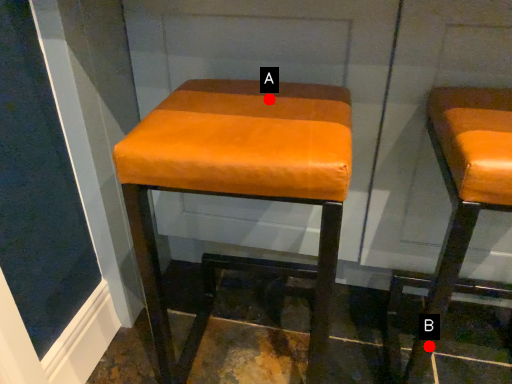
Question: Two points are circled on the image, labeled by A and B beside each circle. Which point is closer to the camera taking this photo?

Choices:
 (A) A is closer
 (B) B is closer

Answer: (B)